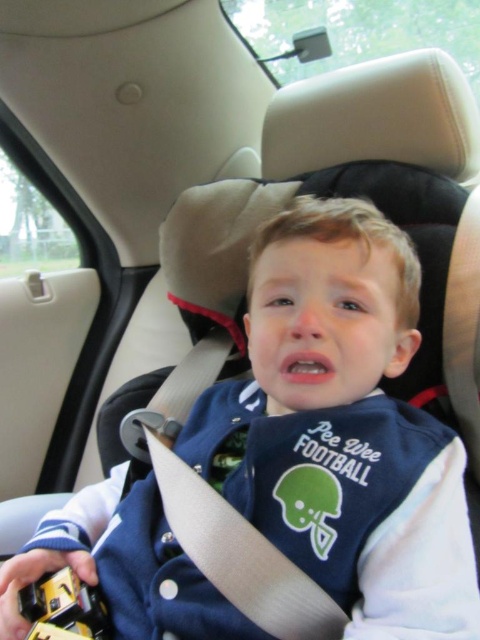
Image resolution: width=480 pixels, height=640 pixels. Find the location of `blue fabric jacket at center`. blue fabric jacket at center is located at coordinates (343, 428).

Can you confirm if blue fabric jacket at center is shorter than yellow plastic toy at lower left?

Incorrect, blue fabric jacket at center's height does not fall short of yellow plastic toy at lower left's.

At what (x,y) coordinates should I click in order to perform the action: click on blue fabric jacket at center. Please return your answer as a coordinate pair (x, y). This screenshot has height=640, width=480. Looking at the image, I should click on (343, 428).

Find the location of a particular element. The image size is (480, 640). blue fabric jacket at center is located at coordinates (343, 428).